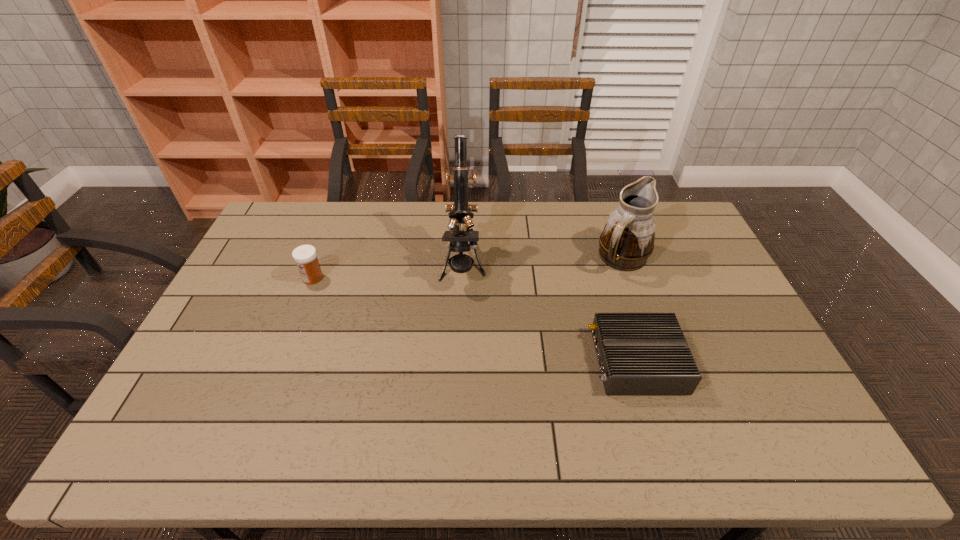
Identify the location of empty space between the leftmost object and the tallest object. This screenshot has height=540, width=960. (388, 271).

Where is `object that is the second closest to the nearest object`? object that is the second closest to the nearest object is located at coordinates (460, 213).

Select which object appears as the third closest to the third shortest object. Please provide its 2D coordinates. Your answer should be formatted as a tuple, i.e. [(x, y)], where the tuple contains the x and y coordinates of a point satisfying the conditions above.

[(305, 256)]

Where is `free location that satisfies the following two spatial constraints: 1. from the spout of the second tallest object; 2. on the back panel of the shortest object`? The image size is (960, 540). free location that satisfies the following two spatial constraints: 1. from the spout of the second tallest object; 2. on the back panel of the shortest object is located at coordinates (659, 361).

At what (x,y) coordinates should I click in order to perform the action: click on free location that satisfies the following two spatial constraints: 1. from the spout of the second tallest object; 2. on the back panel of the router. Please return your answer as a coordinate pair (x, y). Looking at the image, I should click on 659,361.

You are a GUI agent. You are given a task and a screenshot of the screen. Output one action in this format:
    pyautogui.click(x=<x>, y=<y>)
    Task: Click on the vacant space that satisfies the following two spatial constraints: 1. from the spout of the second tallest object; 2. on the back panel of the shortest object
    Image resolution: width=960 pixels, height=540 pixels.
    Given the screenshot: What is the action you would take?
    pyautogui.click(x=659, y=361)